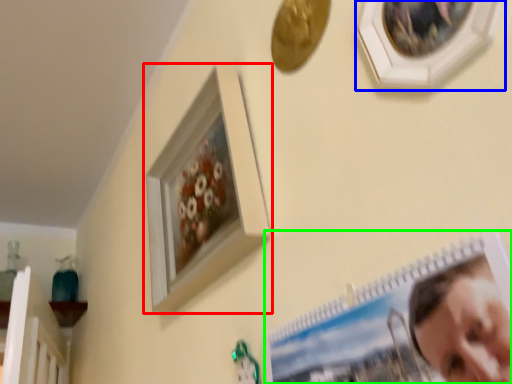
Question: Which is nearer to the picture frame (highlighted by a red box)? picture frame (highlighted by a blue box) or picture frame (highlighted by a green box).

Choices:
 (A) picture frame
 (B) picture frame

Answer: (B)